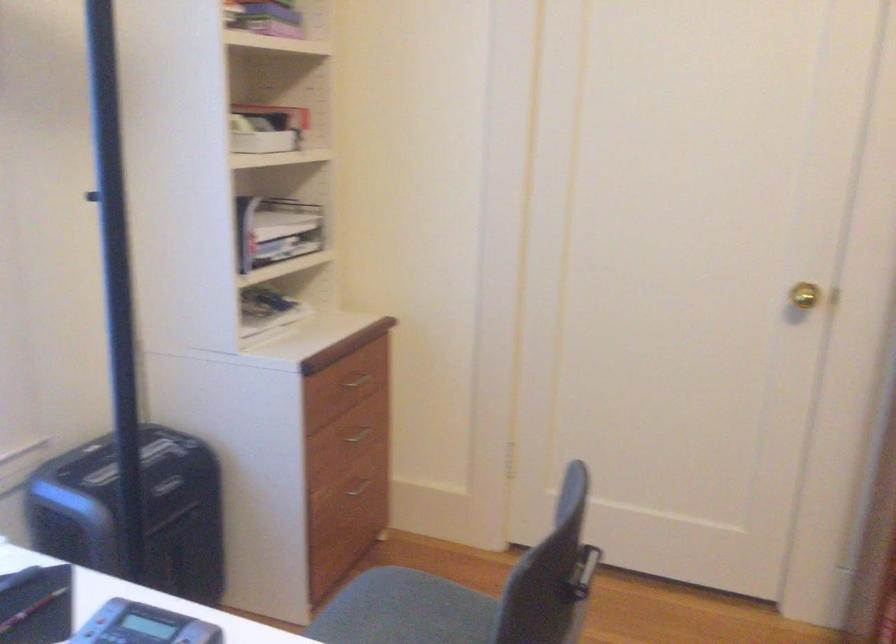
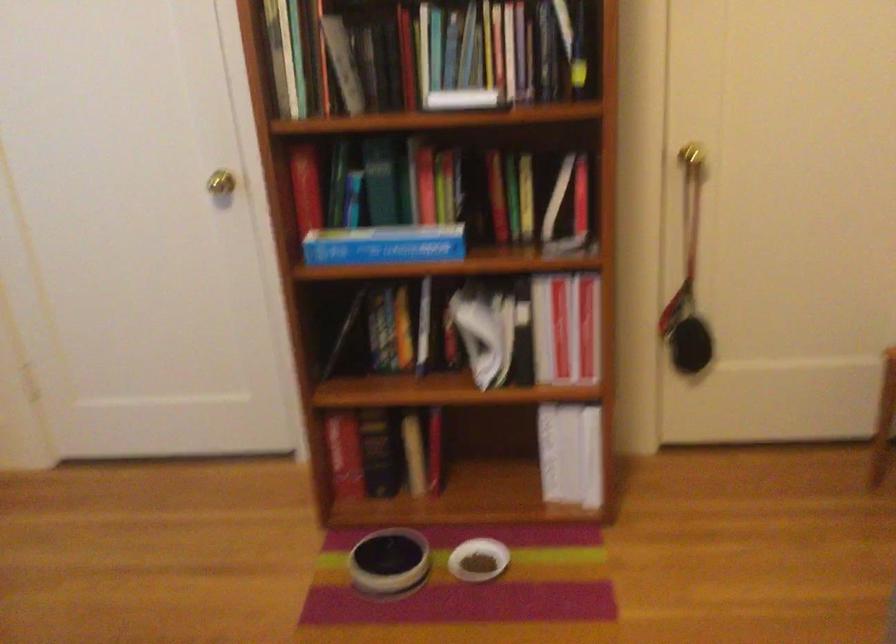
What movement of the cameraman would produce the second image?

The cameraman walked toward right, backward.